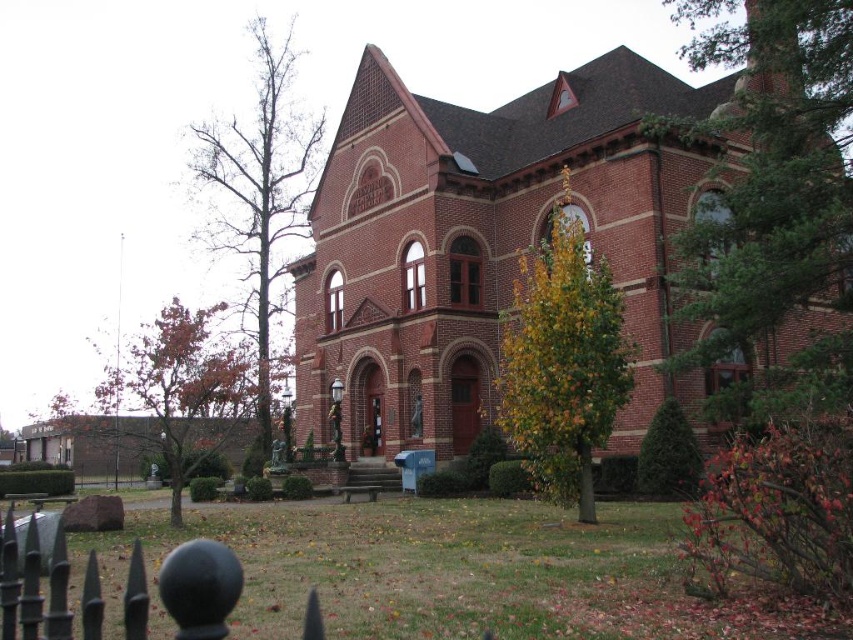
Between yellow-green leaves at center and black wrought iron fence at lower left, which one has more height?

Result: yellow-green leaves at center

Does yellow-green leaves at center appear on the right side of black wrought iron fence at lower left?

Indeed, yellow-green leaves at center is positioned on the right side of black wrought iron fence at lower left.

Does point (576, 243) come in front of point (177, 572)?

No, (576, 243) is behind (177, 572).

Find the location of a particular element. The height and width of the screenshot is (640, 853). yellow-green leaves at center is located at coordinates (561, 358).

Between point (107, 381) and point (218, 547), which one is positioned behind?

Positioned behind is point (107, 381).

Who is more forward, [140,396] or [231,556]?

Point [231,556] is in front.

Where is `brown leafy tree at left`? This screenshot has width=853, height=640. brown leafy tree at left is located at coordinates (175, 396).

Is red brick church at center to the right of brown leafy tree at left from the viewer's perspective?

Yes, red brick church at center is to the right of brown leafy tree at left.

What do you see at coordinates (486, 244) in the screenshot?
I see `red brick church at center` at bounding box center [486, 244].

At what (x,y) coordinates should I click in order to perform the action: click on red brick church at center. Please return your answer as a coordinate pair (x, y). Looking at the image, I should click on (486, 244).